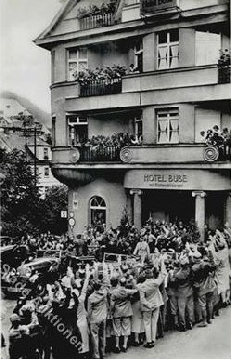
What are the coordinates of `light` in the screenshot? It's located at (204, 196), (197, 197), (139, 195), (125, 198).